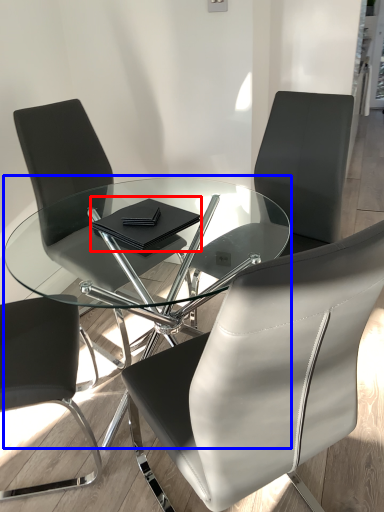
Question: Which object is closer to the camera taking this photo, notebook (highlighted by a red box) or coffee table (highlighted by a blue box)?

Choices:
 (A) notebook
 (B) coffee table

Answer: (B)